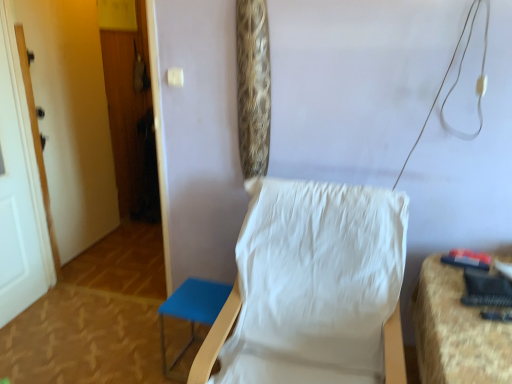
Question: From their relative heights in the image, would you say white painted wood door at left, which ranks as the first door in back-to-front order, is taller or shorter than textured fabric chair at right, placed as the 1th furniture when sorted from right to left?

Choices:
 (A) tall
 (B) short

Answer: (A)

Question: Does point (74, 142) appear closer or farther from the camera than point (424, 339)?

Choices:
 (A) closer
 (B) farther

Answer: (B)

Question: Estimate the real-world distances between objects in this image. Which object is farther from the white painted wood door at left, which ranks as the first door in back-to-front order?

Choices:
 (A) white fabric chair at center
 (B) leopard print fabric at upper center
 (C) textured fabric chair at right, which is the 2th furniture from left to right
 (D) white painted wood door at left, acting as the 1th door starting from the front
 (E) blue fabric stool at lower left, the 1th furniture viewed from the left

Answer: (C)

Question: Which is farther from the white painted wood door at left, the 2th door in the front-to-back sequence?

Choices:
 (A) white fabric chair at center
 (B) textured fabric chair at right, which is the 2th furniture from left to right
 (C) leopard print fabric at upper center
 (D) white painted wood door at left, the 2th door in the back-to-front sequence
 (E) blue fabric stool at lower left, which is the second furniture from right to left

Answer: (B)